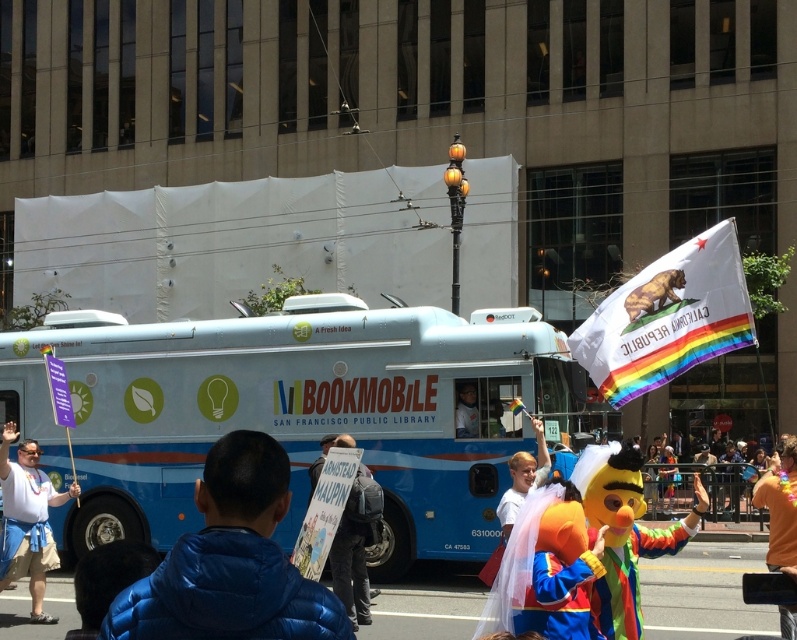
You are standing in front of the San Francisco Public Library Bookmobile and notice a person wearing a blue fabric shirt at left. Where exactly is this person positioned relative to the bookmobile?

The blue fabric shirt at left is located at point [26,518] relative to the bookmobile.